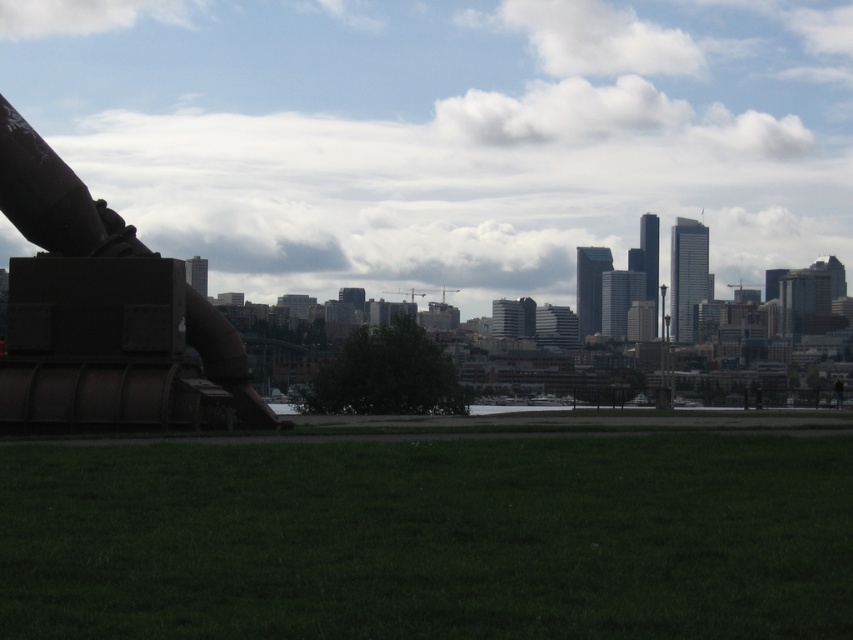
Question: Which point appears closest to the camera in this image?

Choices:
 (A) (88, 198)
 (B) (407, 592)

Answer: (B)

Question: Among these points, which one is nearest to the camera?

Choices:
 (A) (357, 499)
 (B) (33, 227)

Answer: (A)

Question: Is green grass at lower center closer to camera compared to rusty metal cannon at left?

Choices:
 (A) no
 (B) yes

Answer: (B)

Question: Can you confirm if green grass at lower center is smaller than rusty metal cannon at left?

Choices:
 (A) no
 (B) yes

Answer: (A)

Question: Can you confirm if green grass at lower center is positioned above rusty metal cannon at left?

Choices:
 (A) yes
 (B) no

Answer: (B)